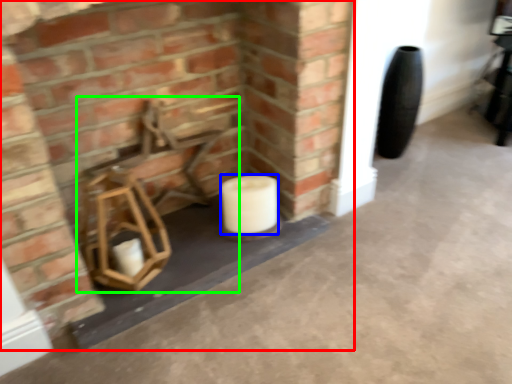
Question: Which object is positioned closest to fireplace (highlighted by a red box)? Select from toilet paper (highlighted by a blue box) and chair (highlighted by a green box).

Choices:
 (A) toilet paper
 (B) chair

Answer: (B)